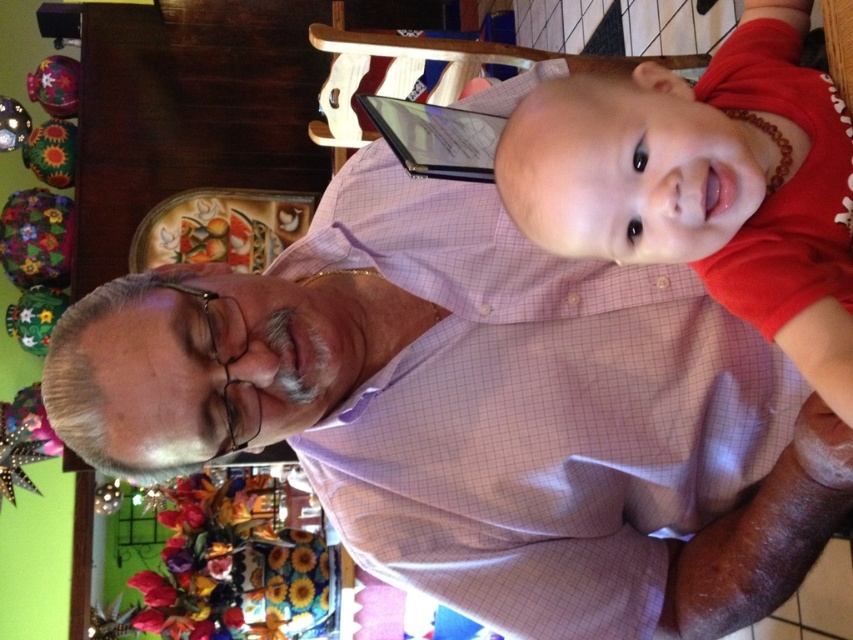
Who is more distant from viewer, (846, 342) or (465, 132)?

The point (465, 132) is behind.

Does red matte shirt at upper right have a lesser width compared to matte black tablet at upper center?

No.

At what (x,y) coordinates should I click in order to perform the action: click on red matte shirt at upper right. Please return your answer as a coordinate pair (x, y). This screenshot has width=853, height=640. Looking at the image, I should click on (705, 186).